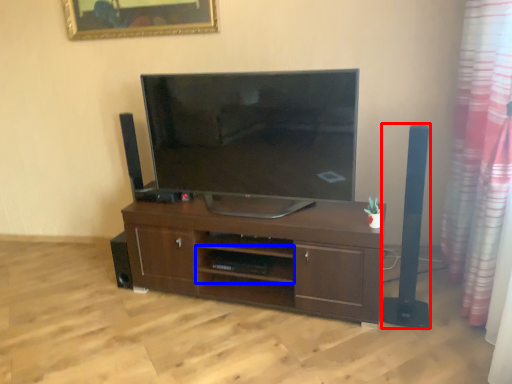
Question: Which of the following is the closest to the observer, speaker (highlighted by a red box) or shelf (highlighted by a blue box)?

Choices:
 (A) speaker
 (B) shelf

Answer: (A)